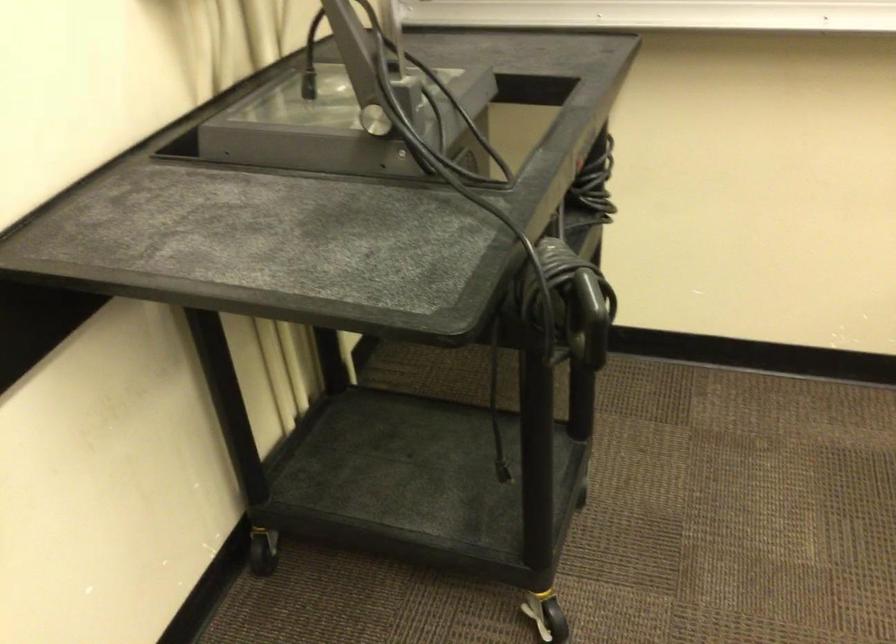
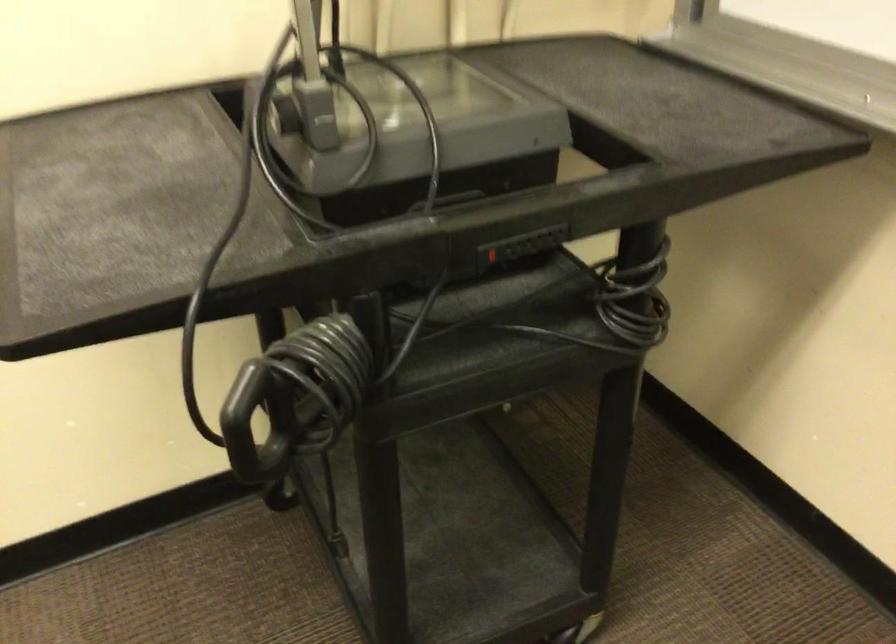
The point at (605, 315) is marked in the first image. Where is the corresponding point in the second image?

(247, 418)